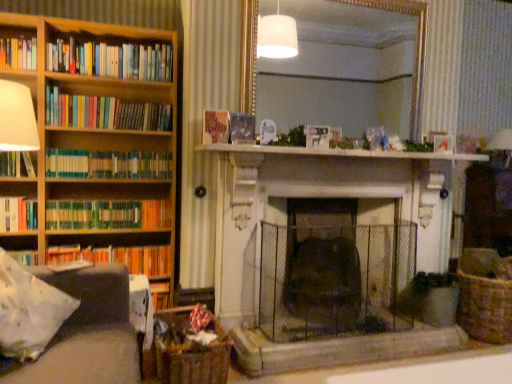
Question: Does wooden bookshelf at left have a greater width compared to wooden book at center, acting as the 3th book starting from the top?

Choices:
 (A) yes
 (B) no

Answer: (A)

Question: Is wooden bookshelf at left not inside wooden book at center, acting as the 3th book starting from the top?

Choices:
 (A) yes
 (B) no

Answer: (A)

Question: Does wooden bookshelf at left contain wooden book at center, the 6th book in the bottom-to-top sequence?

Choices:
 (A) yes
 (B) no

Answer: (B)

Question: Is wooden bookshelf at left in contact with wooden book at center, the 6th book in the bottom-to-top sequence?

Choices:
 (A) yes
 (B) no

Answer: (B)

Question: From the image's perspective, is wooden bookshelf at left under wooden book at center, acting as the 3th book starting from the top?

Choices:
 (A) yes
 (B) no

Answer: (A)

Question: Is green matte bookshelf at left, which is counted as the 2th book, starting from the bottom, wider or thinner than dark gray fabric armchair at left?

Choices:
 (A) wide
 (B) thin

Answer: (B)

Question: From a real-world perspective, relative to dark gray fabric armchair at left, is green matte bookshelf at left, which is counted as the 2th book, starting from the bottom, vertically above or below?

Choices:
 (A) below
 (B) above

Answer: (B)

Question: From the image's perspective, relative to dark gray fabric armchair at left, is green matte bookshelf at left, which is counted as the 2th book, starting from the bottom, above or below?

Choices:
 (A) below
 (B) above

Answer: (B)

Question: Considering the positions of green matte bookshelf at left, the seventh book viewed from the top, and dark gray fabric armchair at left in the image, is green matte bookshelf at left, the seventh book viewed from the top, bigger or smaller than dark gray fabric armchair at left?

Choices:
 (A) small
 (B) big

Answer: (A)

Question: Based on their positions, is woven brown basket at lower right, which is the 2th basket from front to back, located to the left or right of woven brown basket at lower left, positioned as the 1th basket in front-to-back order?

Choices:
 (A) left
 (B) right

Answer: (B)

Question: In terms of height, does woven brown basket at lower right, marked as the first basket in a back-to-front arrangement, look taller or shorter compared to woven brown basket at lower left, the 2th basket viewed from the right?

Choices:
 (A) tall
 (B) short

Answer: (A)

Question: From the image's perspective, is woven brown basket at lower right, acting as the 1th basket starting from the right, above or below woven brown basket at lower left, the 2th basket viewed from the right?

Choices:
 (A) above
 (B) below

Answer: (A)

Question: In terms of size, does woven brown basket at lower right, acting as the 1th basket starting from the right, appear bigger or smaller than woven brown basket at lower left, positioned as the 1th basket in front-to-back order?

Choices:
 (A) small
 (B) big

Answer: (B)

Question: Considering the relative positions of hardcover books at left, the 8th book ordered from the bottom, and white marble fireplace at center in the image provided, is hardcover books at left, the 8th book ordered from the bottom, to the left or to the right of white marble fireplace at center?

Choices:
 (A) left
 (B) right

Answer: (A)

Question: Is hardcover books at left, the 8th book ordered from the bottom, taller or shorter than white marble fireplace at center?

Choices:
 (A) short
 (B) tall

Answer: (B)